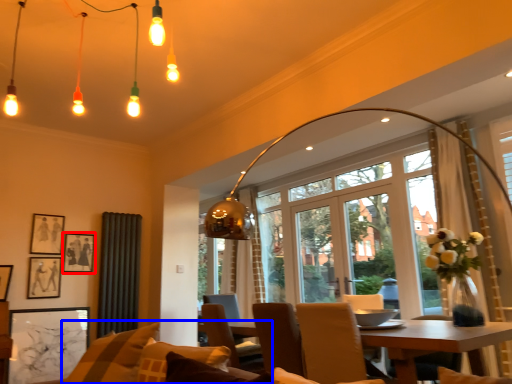
Question: Among these objects, which one is nearest to the camera, picture frame (highlighted by a red box) or couch (highlighted by a blue box)?

Choices:
 (A) picture frame
 (B) couch

Answer: (B)